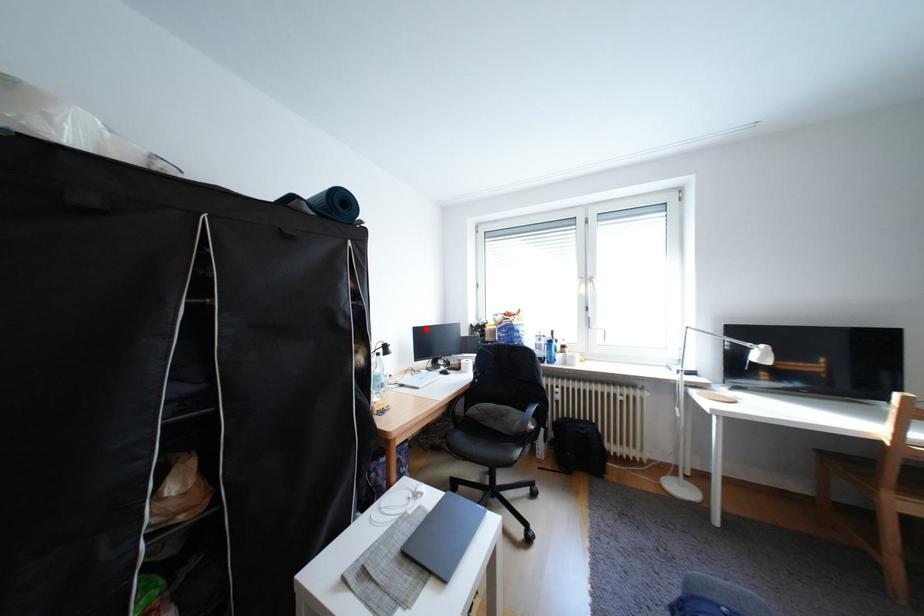
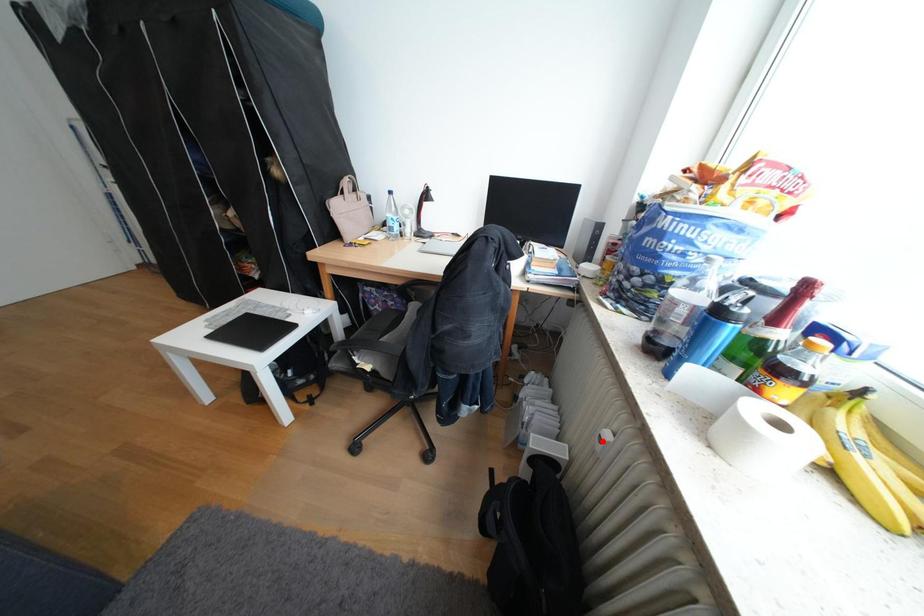
I am providing you with two images of the same scene from different viewpoints. A red point is marked on the first image and another point is marked on the second image. Does the point marked in image1 correspond to the same location as the one in image2?

No